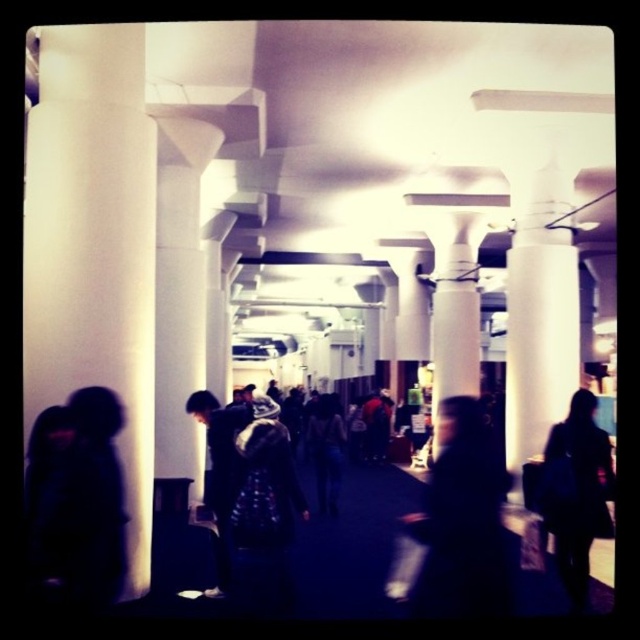
Question: Can you confirm if black fabric backpack at right is positioned to the right of dark blue fabric jacket at center?

Choices:
 (A) no
 (B) yes

Answer: (B)

Question: From the image, what is the correct spatial relationship of white smooth column at left in relation to dark blue jacket at center?

Choices:
 (A) right
 (B) left

Answer: (B)

Question: Which of the following is the farthest from the observer?

Choices:
 (A) white smooth column at center
 (B) black fabric backpack at right
 (C) dark blue textured coat at center
 (D) dark textured coat at center

Answer: (A)

Question: Which object is positioned closest to the white smooth column at right?

Choices:
 (A) dark blue textured coat at center
 (B) white smooth column at left
 (C) dark textured coat at center
 (D) white smooth column at center

Answer: (D)

Question: Which of these objects is positioned closest to the dark blue fabric jacket at center?

Choices:
 (A) dark textured coat at left
 (B) dark blue jacket at center
 (C) white smooth column at center

Answer: (B)

Question: Can you confirm if white smooth column at right is positioned to the right of white smooth column at center?

Choices:
 (A) yes
 (B) no

Answer: (A)